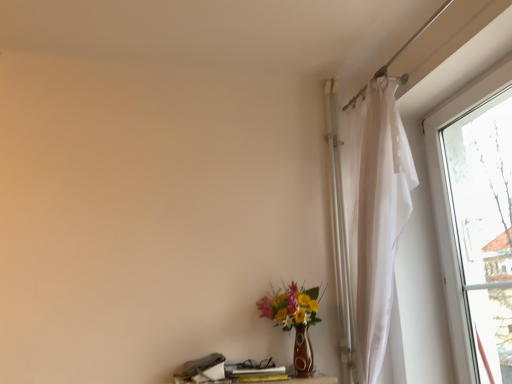
Question: From a real-world perspective, is matte brown vase at lower center above or below wooden table at lower center?

Choices:
 (A) below
 (B) above

Answer: (B)

Question: Relative to wooden table at lower center, is matte brown vase at lower center in front or behind?

Choices:
 (A) behind
 (B) front

Answer: (A)

Question: Which is correct: matte brown vase at lower center is inside wooden table at lower center, or outside of it?

Choices:
 (A) inside
 (B) outside

Answer: (B)

Question: Considering the positions of wooden table at lower center and matte brown vase at lower center in the image, is wooden table at lower center taller or shorter than matte brown vase at lower center?

Choices:
 (A) tall
 (B) short

Answer: (B)

Question: Is point (269, 382) closer or farther from the camera than point (296, 337)?

Choices:
 (A) closer
 (B) farther

Answer: (A)

Question: Would you say wooden table at lower center is to the left or to the right of matte brown vase at lower center in the picture?

Choices:
 (A) left
 (B) right

Answer: (A)

Question: From the image's perspective, relative to matte brown vase at lower center, is wooden table at lower center above or below?

Choices:
 (A) below
 (B) above

Answer: (A)